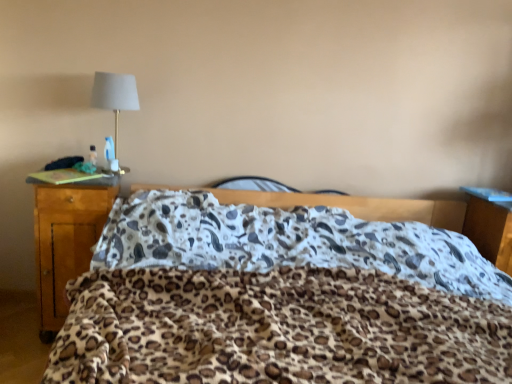
Question: Is point [504, 269] positioned closer to the camera than point [467, 372]?

Choices:
 (A) farther
 (B) closer

Answer: (A)

Question: Considering the positions of wooden nightstand at right and leopard print blanket at center in the image, is wooden nightstand at right wider or thinner than leopard print blanket at center?

Choices:
 (A) thin
 (B) wide

Answer: (A)

Question: Which object is positioned closest to the leopard print blanket at center?

Choices:
 (A) wooden nightstand at right
 (B) wooden desk at left
 (C) matte gold lamp at upper left

Answer: (B)

Question: Estimate the real-world distances between objects in this image. Which object is farther from the matte gold lamp at upper left?

Choices:
 (A) leopard print blanket at center
 (B) wooden desk at left
 (C) wooden nightstand at right

Answer: (C)